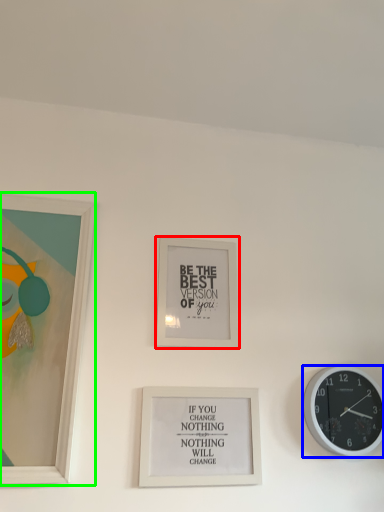
Question: Which is nearer to the picture frame (highlighted by a red box)? wall clock (highlighted by a blue box) or picture frame (highlighted by a green box).

Choices:
 (A) wall clock
 (B) picture frame

Answer: (B)